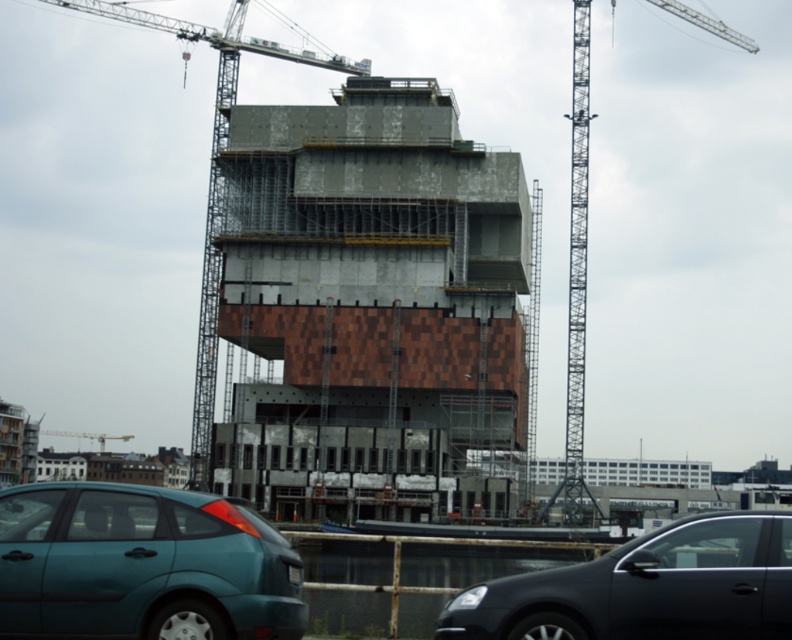
You are a delivery driver approaching the construction site and need to park your vehicle. You see the shiny black sedan at lower right and the gray metallic crane at upper center. Which object is positioned more to the right side of the scene?

The shiny black sedan at lower right is positioned to the right of the gray metallic crane at upper center, so the shiny black sedan at lower right is more to the right side of the scene.

You are a delivery driver arriving at the construction site. You need to park your teal matte hatchback at lower left. The parking spot next to the metallic gray crane at upper left is 2 meters wide. Is your car narrow enough to fit?

The teal matte hatchback at lower left is narrower than the metallic gray crane at upper left. However, the crane is likely much larger in overall size, so the car should fit in a 2 meter wide parking spot.

You are a construction worker standing at the entrance of the construction site. You need to move a heavy beam from the concrete at center to the metallic scaffolding at right. Which object should you place the beam on first, and why?

You should place the beam on the concrete at center first because it is in front of the metallic scaffolding at right, making it the closer and more accessible surface for placement.